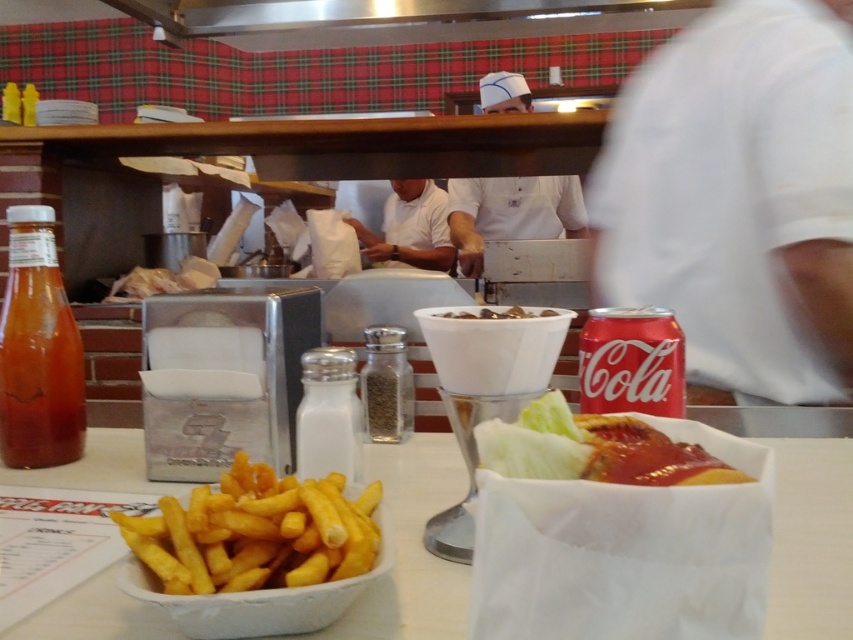
Question: Which of these objects is positioned closest to the white uniform at center?

Choices:
 (A) white paper bag at lower center
 (B) translucent glass can at left
 (C) golden crispy french fries at lower left
 (D) white glass salt shaker at center

Answer: (B)

Question: Does white glass salt shaker at center have a larger size compared to clear glass pepper shaker at center?

Choices:
 (A) no
 (B) yes

Answer: (B)

Question: Is translucent glass can at left to the left of clear glass pepper shaker at center from the viewer's perspective?

Choices:
 (A) no
 (B) yes

Answer: (B)

Question: Which point is closer to the camera?

Choices:
 (A) brown matte bowl at center
 (B) golden crispy french fries at lower left
 (C) shiny plastic basket at center

Answer: (C)

Question: Which of these objects is positioned closest to the translucent glass can at left?

Choices:
 (A) white paper bag at lower center
 (B) shiny plastic basket at center

Answer: (A)

Question: Considering the relative positions of white paper bag at lower center and translucent glass can at left in the image provided, where is white paper bag at lower center located with respect to translucent glass can at left?

Choices:
 (A) left
 (B) right

Answer: (B)